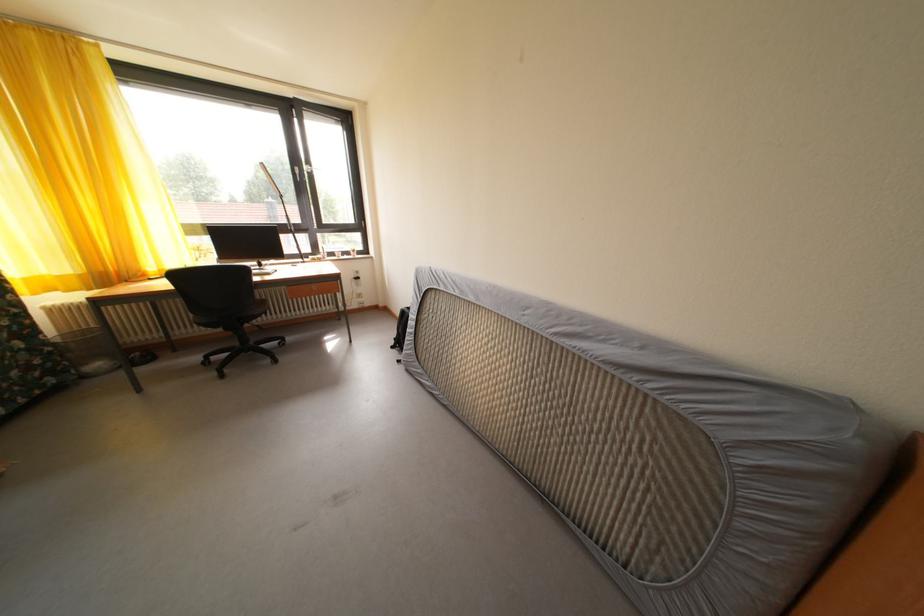
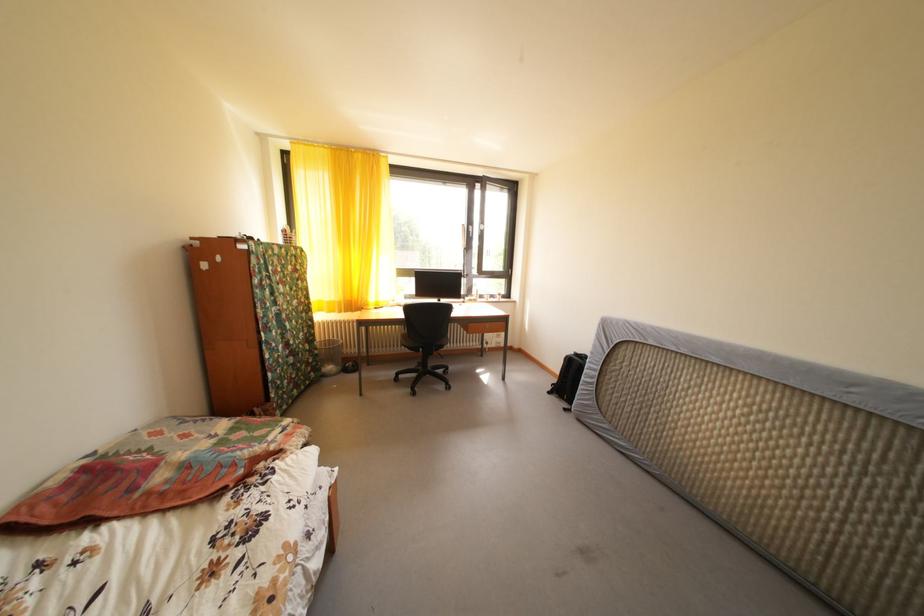
Question: The images are taken continuously from a first-person perspective. In which direction are you moving?

Choices:
 (A) Left
 (B) Right
 (C) Forward
 (D) Backward

Answer: (A)